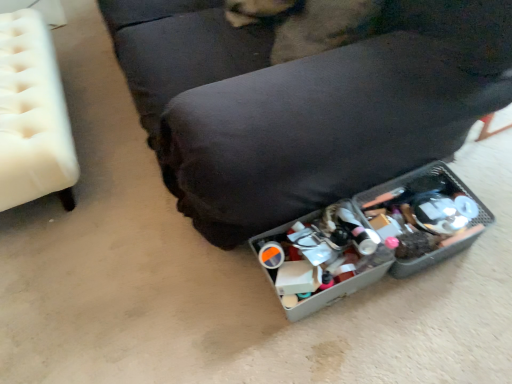
Find the location of a particular element. The height and width of the screenshot is (384, 512). white tufted ottoman at left, which is the first furniture from left to right is located at coordinates (32, 115).

This screenshot has height=384, width=512. What do you see at coordinates (307, 23) in the screenshot?
I see `fuzzy brown dog at center` at bounding box center [307, 23].

Find the location of `metallic gray storage bin at lower right, the 2th furniture from the left`. metallic gray storage bin at lower right, the 2th furniture from the left is located at coordinates (304, 96).

Is metallic gray storage bin at lower right, which appears as the 1th furniture when viewed from the right, facing away from fuzzy brown dog at center?

Yes, fuzzy brown dog at center is at the back of metallic gray storage bin at lower right, which appears as the 1th furniture when viewed from the right.

Is metallic gray storage bin at lower right, the 2th furniture from the left, in front of or behind fuzzy brown dog at center in the image?

metallic gray storage bin at lower right, the 2th furniture from the left, is in front of fuzzy brown dog at center.

Based on the photo, is metallic gray storage bin at lower right, the 2th furniture from the left, thinner than fuzzy brown dog at center?

In fact, metallic gray storage bin at lower right, the 2th furniture from the left, might be wider than fuzzy brown dog at center.

Would you say metallic gray storage bin at lower right, which appears as the 1th furniture when viewed from the right, is a long distance from white tufted ottoman at left, which appears as the second furniture when viewed from the right?

metallic gray storage bin at lower right, which appears as the 1th furniture when viewed from the right, is near white tufted ottoman at left, which appears as the second furniture when viewed from the right, not far away.

Which is behind, metallic gray storage bin at lower right, the 2th furniture from the left, or white tufted ottoman at left, which appears as the second furniture when viewed from the right?

white tufted ottoman at left, which appears as the second furniture when viewed from the right, is behind.

You are a GUI agent. You are given a task and a screenshot of the screen. Output one action in this format:
    pyautogui.click(x=<x>, y=<y>)
    Task: Click on the furniture behind the metallic gray storage bin at lower right, which appears as the 1th furniture when viewed from the right
    The height and width of the screenshot is (384, 512).
    Given the screenshot: What is the action you would take?
    pyautogui.click(x=32, y=115)

From the image's perspective, is metallic gray storage bin at lower right, the 2th furniture from the left, below white tufted ottoman at left, which is the first furniture from left to right?

Actually, metallic gray storage bin at lower right, the 2th furniture from the left, appears above white tufted ottoman at left, which is the first furniture from left to right, in the image.

From a real-world perspective, who is located higher, white tufted ottoman at left, which is the first furniture from left to right, or metallic gray storage bin at lower right, the 2th furniture from the left?

metallic gray storage bin at lower right, the 2th furniture from the left, from a real-world perspective.

Which object is further away from the camera taking this photo, white tufted ottoman at left, which appears as the second furniture when viewed from the right, or metallic gray storage bin at lower right, the 2th furniture from the left?

Positioned behind is white tufted ottoman at left, which appears as the second furniture when viewed from the right.

From the image's perspective, between white tufted ottoman at left, which appears as the second furniture when viewed from the right, and metallic gray storage bin at lower right, the 2th furniture from the left, who is located below?

white tufted ottoman at left, which appears as the second furniture when viewed from the right, appears lower in the image.

Considering the positions of points (32, 194) and (219, 65), is point (32, 194) farther from camera compared to point (219, 65)?

Yes.

Is fuzzy brown dog at center turned away from white tufted ottoman at left, which appears as the second furniture when viewed from the right?

fuzzy brown dog at center does not have its back to white tufted ottoman at left, which appears as the second furniture when viewed from the right.

Considering the sizes of fuzzy brown dog at center and white tufted ottoman at left, which appears as the second furniture when viewed from the right, in the image, is fuzzy brown dog at center taller or shorter than white tufted ottoman at left, which appears as the second furniture when viewed from the right,?

fuzzy brown dog at center is shorter than white tufted ottoman at left, which appears as the second furniture when viewed from the right.

Is fuzzy brown dog at center at the right side of white tufted ottoman at left, which is the first furniture from left to right?

Yes, fuzzy brown dog at center is to the right of white tufted ottoman at left, which is the first furniture from left to right.

Does fuzzy brown dog at center contain metallic gray storage bin at lower right, the 2th furniture from the left?

No, metallic gray storage bin at lower right, the 2th furniture from the left, is not inside fuzzy brown dog at center.

Looking at this image, considering the sizes of fuzzy brown dog at center and metallic gray storage bin at lower right, the 2th furniture from the left, in the image, is fuzzy brown dog at center taller or shorter than metallic gray storage bin at lower right, the 2th furniture from the left,?

In the image, fuzzy brown dog at center appears to be shorter than metallic gray storage bin at lower right, the 2th furniture from the left.

Which is closer to the camera, (366, 25) or (446, 106)?

The point (446, 106) is in front.

From the image's perspective, between fuzzy brown dog at center and metallic gray storage bin at lower right, which appears as the 1th furniture when viewed from the right, which one is located above?

metallic gray storage bin at lower right, which appears as the 1th furniture when viewed from the right, appears higher in the image.

From the image's perspective, is white tufted ottoman at left, which is the first furniture from left to right, over fuzzy brown dog at center?

No.

Locate an element on the screen. Image resolution: width=512 pixels, height=384 pixels. animal on the right side of white tufted ottoman at left, which appears as the second furniture when viewed from the right is located at coordinates (307, 23).

Is white tufted ottoman at left, which is the first furniture from left to right, shorter than fuzzy brown dog at center?

No, white tufted ottoman at left, which is the first furniture from left to right, is not shorter than fuzzy brown dog at center.

Is white tufted ottoman at left, which is the first furniture from left to right, positioned with its back to fuzzy brown dog at center?

That's not correct — white tufted ottoman at left, which is the first furniture from left to right, is not looking away from fuzzy brown dog at center.

The image size is (512, 384). In order to click on animal below the metallic gray storage bin at lower right, which appears as the 1th furniture when viewed from the right (from a real-world perspective) in this screenshot , I will do `click(307, 23)`.

Locate an element on the screen. The width and height of the screenshot is (512, 384). furniture in front of the white tufted ottoman at left, which appears as the second furniture when viewed from the right is located at coordinates (304, 96).

From the image, which object appears to be nearer to white tufted ottoman at left, which appears as the second furniture when viewed from the right, metallic gray storage bin at lower right, the 2th furniture from the left, or fuzzy brown dog at center?

metallic gray storage bin at lower right, the 2th furniture from the left, is positioned closer to the anchor white tufted ottoman at left, which appears as the second furniture when viewed from the right.

When comparing their distances from white tufted ottoman at left, which is the first furniture from left to right, does fuzzy brown dog at center or metallic gray storage bin at lower right, which appears as the 1th furniture when viewed from the right, seem further?

fuzzy brown dog at center is further to white tufted ottoman at left, which is the first furniture from left to right.

When comparing their distances from fuzzy brown dog at center, does metallic gray storage bin at lower right, which appears as the 1th furniture when viewed from the right, or white tufted ottoman at left, which is the first furniture from left to right, seem further?

Based on the image, white tufted ottoman at left, which is the first furniture from left to right, appears to be further to fuzzy brown dog at center.

Considering their positions, is fuzzy brown dog at center positioned closer to metallic gray storage bin at lower right, which appears as the 1th furniture when viewed from the right, than white tufted ottoman at left, which is the first furniture from left to right?

Based on the image, fuzzy brown dog at center appears to be nearer to metallic gray storage bin at lower right, which appears as the 1th furniture when viewed from the right.

Considering their positions, is white tufted ottoman at left, which appears as the second furniture when viewed from the right, positioned further to fuzzy brown dog at center than metallic gray storage bin at lower right, the 2th furniture from the left?

Among the two, white tufted ottoman at left, which appears as the second furniture when viewed from the right, is located further to fuzzy brown dog at center.

Estimate the real-world distances between objects in this image. Which object is further from metallic gray storage bin at lower right, which appears as the 1th furniture when viewed from the right, white tufted ottoman at left, which is the first furniture from left to right, or fuzzy brown dog at center?

white tufted ottoman at left, which is the first furniture from left to right, lies further to metallic gray storage bin at lower right, which appears as the 1th furniture when viewed from the right, than the other object.

Image resolution: width=512 pixels, height=384 pixels. Find the location of `furniture situated between white tufted ottoman at left, which is the first furniture from left to right, and fuzzy brown dog at center from left to right`. furniture situated between white tufted ottoman at left, which is the first furniture from left to right, and fuzzy brown dog at center from left to right is located at coordinates (304, 96).